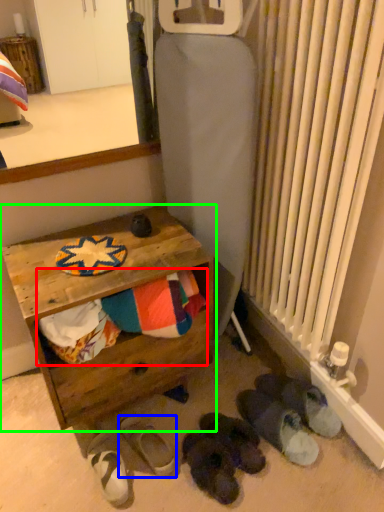
Question: Estimate the real-world distances between objects in this image. Which object is closer to laundry (highlighted by a red box), footwear (highlighted by a blue box) or table (highlighted by a green box)?

Choices:
 (A) footwear
 (B) table

Answer: (B)